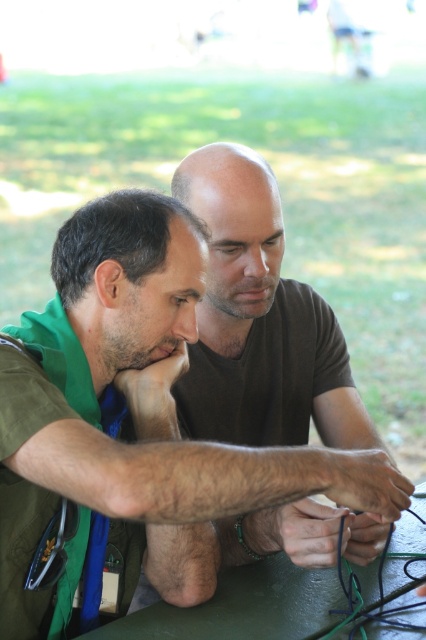
You are a photographer trying to capture a clear photo of the green fabric shirt at center and the green matte table at center. Since both are green, you want to ensure they are distinguishable in the final image. Which object should you focus on to make sure it appears closer to the viewer?

The green fabric shirt at center is in front of the green matte table at center, so focusing on the green fabric shirt at center will make it appear closer to the viewer.

In the scene shown: You are a photographer standing behind the two people at the table. You want to take a photo that captures both the green fabric shirt at center and the green matte table at center clearly. Which object will appear taller in the photo?

The green fabric shirt at center will appear taller in the photo because it has a greater height compared to the green matte table at center.